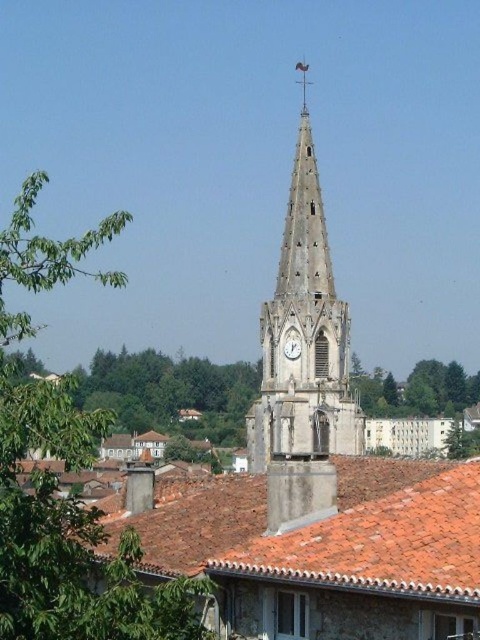
Can you confirm if green leafy tree at left is positioned to the right of red clay tiles at center?

No, green leafy tree at left is not to the right of red clay tiles at center.

Which is below, green leafy tree at left or red clay tiles at center?

red clay tiles at center is lower down.

Locate an element on the screen. This screenshot has height=640, width=480. green leafy tree at left is located at coordinates (68, 468).

Who is lower down, green leafy tree at left or stone clock tower at center?

green leafy tree at left is lower down.

Describe the element at coordinates (68, 468) in the screenshot. I see `green leafy tree at left` at that location.

This screenshot has height=640, width=480. In order to click on green leafy tree at left in this screenshot , I will do `click(68, 468)`.

Does point (255, 524) lie behind point (289, 349)?

No, (255, 524) is closer to viewer.

Is red clay tiles at center taller than white stone clock at center?

Indeed, red clay tiles at center has a greater height compared to white stone clock at center.

The image size is (480, 640). What are the coordinates of `red clay tiles at center` in the screenshot? It's located at (330, 531).